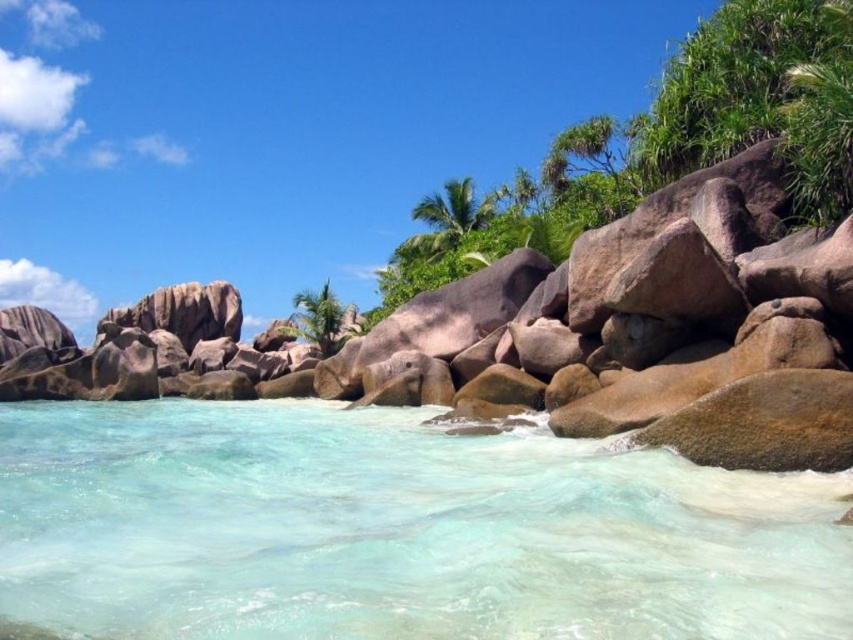
Based on the photo, is clear water at lower center to the right of green leafy palm tree at upper center from the viewer's perspective?

In fact, clear water at lower center is to the left of green leafy palm tree at upper center.

Does clear water at lower center appear on the left side of green leafy palm tree at upper center?

Correct, you'll find clear water at lower center to the left of green leafy palm tree at upper center.

Does point (299, 412) come closer to viewer compared to point (444, 244)?

Yes, it is.

Where is `clear water at lower center`? This screenshot has width=853, height=640. clear water at lower center is located at coordinates (397, 531).

Is clear water at lower center bigger than green leafy palm tree at center?

No, clear water at lower center is not bigger than green leafy palm tree at center.

Looking at this image, does clear water at lower center appear on the right side of green leafy palm tree at center?

Yes, clear water at lower center is to the right of green leafy palm tree at center.

Identify the location of clear water at lower center. This screenshot has width=853, height=640. (397, 531).

Is point (431, 225) positioned behind point (328, 326)?

Yes, it is.

Between green leafy palm tree at upper center and green leafy palm tree at center, which one has less height?

green leafy palm tree at center is shorter.

Image resolution: width=853 pixels, height=640 pixels. Find the location of `green leafy palm tree at upper center`. green leafy palm tree at upper center is located at coordinates (448, 218).